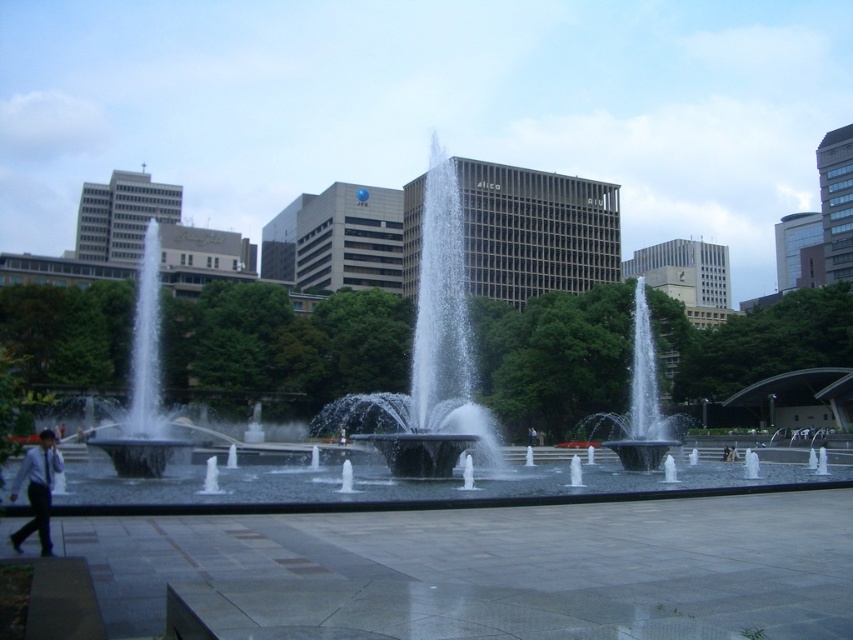
Question: Is clear water at center above dark gray suit at lower left?

Choices:
 (A) yes
 (B) no

Answer: (A)

Question: Which object appears farthest from the camera in this image?

Choices:
 (A) black glossy fountain at center
 (B) black fabric person at center
 (C) dark gray suit at lower left
 (D) clear water at center

Answer: (B)

Question: Among these objects, which one is farthest from the camera?

Choices:
 (A) black fabric person at center
 (B) clear glass water at center
 (C) black glossy fountain at center

Answer: (A)

Question: Among these points, which one is nearest to the camera?

Choices:
 (A) (141, 342)
 (B) (33, 452)
 (C) (637, 362)

Answer: (B)

Question: Can you confirm if dark gray suit at lower left is bigger than black fabric person at center?

Choices:
 (A) yes
 (B) no

Answer: (A)

Question: Does clear water at center appear under clear glass water at center left?

Choices:
 (A) yes
 (B) no

Answer: (A)